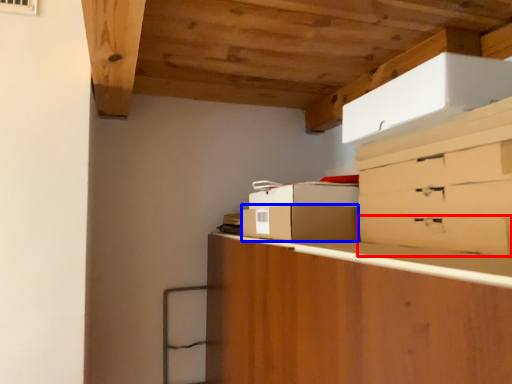
Question: Which point is further to the camera, drawer (highlighted by a red box) or cardboard box (highlighted by a blue box)?

Choices:
 (A) drawer
 (B) cardboard box

Answer: (B)